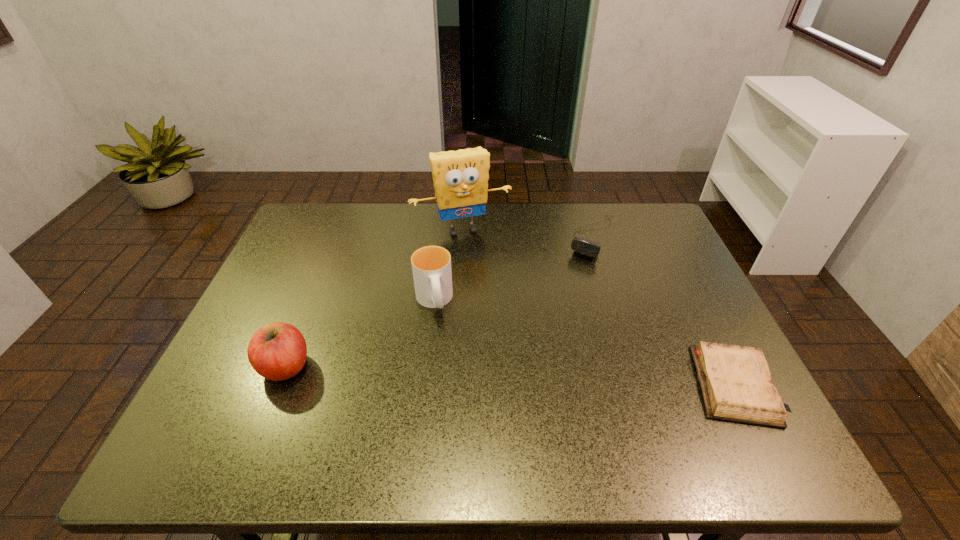
Where is `the leftmost object`? This screenshot has width=960, height=540. the leftmost object is located at coordinates (277, 351).

Where is `the rightmost object`? the rightmost object is located at coordinates (735, 381).

Find the location of a particular element. This screenshot has height=540, width=960. diary is located at coordinates click(735, 381).

What are the coordinates of `sponge` in the screenshot? It's located at (460, 177).

Where is `the second object from right to left`? This screenshot has width=960, height=540. the second object from right to left is located at coordinates (582, 246).

Locate an element on the screen. This screenshot has height=540, width=960. the second shortest object is located at coordinates (582, 246).

Where is `the third farthest object`? the third farthest object is located at coordinates (431, 265).

This screenshot has width=960, height=540. I want to click on vacant space situated on the right of the apple, so click(x=378, y=367).

Find the location of a particular element. This screenshot has height=540, width=960. free space located 0.190m on the back of the rightmost object is located at coordinates (686, 291).

This screenshot has width=960, height=540. In order to click on free space located on the face of the sponge in this screenshot , I will do `click(513, 332)`.